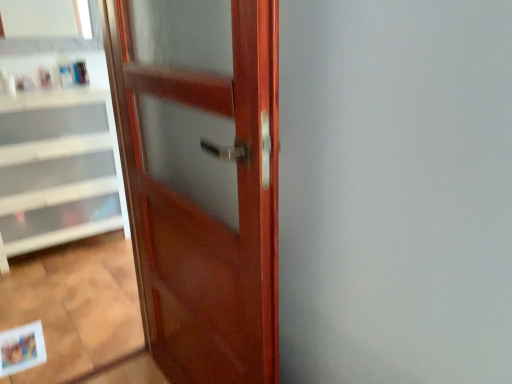
The image size is (512, 384). What do you see at coordinates (65, 71) in the screenshot? I see `translucent plastic bottle at upper left, the 2th toiletry in the right-to-left sequence` at bounding box center [65, 71].

What is the approximate width of matte plastic bottle at upper left, the first toiletry when ordered from left to right?

2.29 inches.

The width and height of the screenshot is (512, 384). What do you see at coordinates (45, 78) in the screenshot?
I see `matte plastic bottle at upper left, the first toiletry when ordered from left to right` at bounding box center [45, 78].

I want to click on white glossy cabinet at left, so click(56, 168).

The width and height of the screenshot is (512, 384). What are the coordinates of `translucent plastic bottle at upper left, which ranks as the second toiletry in left-to-right order` in the screenshot? It's located at (65, 71).

In the image, is translucent plastic bottle at upper left, the 2th toiletry in the right-to-left sequence, positioned in front of or behind matte plastic bottle at upper left, positioned as the third toiletry in left-to-right order?

In the image, translucent plastic bottle at upper left, the 2th toiletry in the right-to-left sequence, appears in front of matte plastic bottle at upper left, positioned as the third toiletry in left-to-right order.

From the image's perspective, is translucent plastic bottle at upper left, the 2th toiletry in the right-to-left sequence, located above or below matte plastic bottle at upper left, the first toiletry viewed from the right?

Clearly, from the image's perspective, translucent plastic bottle at upper left, the 2th toiletry in the right-to-left sequence, is below matte plastic bottle at upper left, the first toiletry viewed from the right.

Find the location of a particular element. the 1st toiletry counting from the left of the matte plastic bottle at upper left, positioned as the third toiletry in left-to-right order is located at coordinates (65, 71).

Is translucent plastic bottle at upper left, which ranks as the second toiletry in left-to-right order, taller than matte plastic bottle at upper left, positioned as the third toiletry in left-to-right order?

Correct, translucent plastic bottle at upper left, which ranks as the second toiletry in left-to-right order, is much taller as matte plastic bottle at upper left, positioned as the third toiletry in left-to-right order.

From the picture: Is matte paper postcard at lower left wider or thinner than matte plastic bottle at upper left, the first toiletry viewed from the right?

matte paper postcard at lower left is wider than matte plastic bottle at upper left, the first toiletry viewed from the right.

Is matte paper postcard at lower left touching matte plastic bottle at upper left, positioned as the third toiletry in left-to-right order?

There is a gap between matte paper postcard at lower left and matte plastic bottle at upper left, positioned as the third toiletry in left-to-right order.

Measure the distance between matte paper postcard at lower left and matte plastic bottle at upper left, positioned as the third toiletry in left-to-right order.

The distance of matte paper postcard at lower left from matte plastic bottle at upper left, positioned as the third toiletry in left-to-right order, is 1.65 meters.

Is matte paper postcard at lower left to the left of matte plastic bottle at upper left, positioned as the third toiletry in left-to-right order, from the viewer's perspective?

Incorrect, matte paper postcard at lower left is not on the left side of matte plastic bottle at upper left, positioned as the third toiletry in left-to-right order.

Considering the relative positions of matte plastic bottle at upper left, positioned as the third toiletry in left-to-right order, and translucent plastic bottle at upper left, the 2th toiletry in the right-to-left sequence, in the image provided, is matte plastic bottle at upper left, positioned as the third toiletry in left-to-right order, to the left of translucent plastic bottle at upper left, the 2th toiletry in the right-to-left sequence, from the viewer's perspective?

No.

Locate an element on the screen. toiletry above the translucent plastic bottle at upper left, which ranks as the second toiletry in left-to-right order (from the image's perspective) is located at coordinates (80, 72).

Is matte plastic bottle at upper left, positioned as the third toiletry in left-to-right order, turned away from translucent plastic bottle at upper left, the 2th toiletry in the right-to-left sequence?

No, translucent plastic bottle at upper left, the 2th toiletry in the right-to-left sequence, is not at the back of matte plastic bottle at upper left, positioned as the third toiletry in left-to-right order.

Is matte plastic bottle at upper left, the first toiletry viewed from the right, touching translucent plastic bottle at upper left, which ranks as the second toiletry in left-to-right order?

Yes, matte plastic bottle at upper left, the first toiletry viewed from the right, is beside translucent plastic bottle at upper left, which ranks as the second toiletry in left-to-right order.

Who is shorter, white glossy cabinet at left or matte paper postcard at lower left?

Standing shorter between the two is matte paper postcard at lower left.

I want to click on cabinetry behind the matte paper postcard at lower left, so click(x=56, y=168).

Looking at the image, does white glossy cabinet at left seem bigger or smaller compared to matte paper postcard at lower left?

Considering their sizes, white glossy cabinet at left takes up more space than matte paper postcard at lower left.

Is white glossy cabinet at left situated inside matte paper postcard at lower left or outside?

white glossy cabinet at left is not inside matte paper postcard at lower left, it's outside.

Do you think glossy wood door at center is within matte paper postcard at lower left, or outside of it?

glossy wood door at center is not enclosed by matte paper postcard at lower left.

How different are the orientations of glossy wood door at center and matte paper postcard at lower left in degrees?

85.9 degrees.

Identify the location of postcard behind the glossy wood door at center. The image size is (512, 384). (22, 348).

Looking at this image, between glossy wood door at center and matte paper postcard at lower left, which one is positioned behind?

matte paper postcard at lower left is further from the camera.

Is translucent plastic bottle at upper left, the 2th toiletry in the right-to-left sequence, aimed at white glossy cabinet at left?

No.

From a real-world perspective, is translucent plastic bottle at upper left, the 2th toiletry in the right-to-left sequence, beneath white glossy cabinet at left?

Incorrect, from a real-world perspective, translucent plastic bottle at upper left, the 2th toiletry in the right-to-left sequence, is higher than white glossy cabinet at left.

Is there a large distance between translucent plastic bottle at upper left, the 2th toiletry in the right-to-left sequence, and white glossy cabinet at left?

Actually, translucent plastic bottle at upper left, the 2th toiletry in the right-to-left sequence, and white glossy cabinet at left are a little close together.

Is point (60, 72) closer or farther from the camera than point (24, 129)?

Clearly, point (60, 72) is more distant from the camera than point (24, 129).

Does matte paper postcard at lower left have a greater height compared to white glossy cabinet at left?

Incorrect, the height of matte paper postcard at lower left is not larger of that of white glossy cabinet at left.

Is white glossy cabinet at left completely or partially inside matte paper postcard at lower left?

No, white glossy cabinet at left is not a part of matte paper postcard at lower left.

Is point (7, 364) closer to viewer compared to point (123, 223)?

Yes.

Is matte paper postcard at lower left to the left or to the right of white glossy cabinet at left in the image?

matte paper postcard at lower left is positioned on white glossy cabinet at left's right side.

At what (x,y) coordinates should I click in order to perform the action: click on toiletry that is the 1st object located below the matte plastic bottle at upper left, the first toiletry viewed from the right (from the image's perspective). Please return your answer as a coordinate pair (x, y). Image resolution: width=512 pixels, height=384 pixels. Looking at the image, I should click on (65, 71).

Image resolution: width=512 pixels, height=384 pixels. Find the location of `the 3rd toiletry behind the matte paper postcard at lower left, starting your count from the anchor`. the 3rd toiletry behind the matte paper postcard at lower left, starting your count from the anchor is located at coordinates (80, 72).

Looking at this image, from the image, which object appears to be nearer to matte plastic bottle at upper left, the first toiletry viewed from the right, white glossy cabinet at left or glossy wood door at center?

The object closer to matte plastic bottle at upper left, the first toiletry viewed from the right, is white glossy cabinet at left.

Considering their positions, is matte plastic bottle at upper left, the first toiletry viewed from the right, positioned further to white glossy cabinet at left than matte plastic bottle at upper left, positioned as the 3th toiletry in right-to-left order?

matte plastic bottle at upper left, the first toiletry viewed from the right.

When comparing their distances from matte plastic bottle at upper left, positioned as the third toiletry in left-to-right order, does matte plastic bottle at upper left, positioned as the 3th toiletry in right-to-left order, or matte paper postcard at lower left seem closer?

matte plastic bottle at upper left, positioned as the 3th toiletry in right-to-left order, is closer to matte plastic bottle at upper left, positioned as the third toiletry in left-to-right order.

Which object lies nearer to the anchor point matte paper postcard at lower left, matte plastic bottle at upper left, positioned as the 3th toiletry in right-to-left order, or white glossy cabinet at left?

white glossy cabinet at left is positioned closer to the anchor matte paper postcard at lower left.

Looking at the image, which one is located further to glossy wood door at center, translucent plastic bottle at upper left, the 2th toiletry in the right-to-left sequence, or matte paper postcard at lower left?

translucent plastic bottle at upper left, the 2th toiletry in the right-to-left sequence, is positioned further to the anchor glossy wood door at center.

When comparing their distances from translucent plastic bottle at upper left, the 2th toiletry in the right-to-left sequence, does matte plastic bottle at upper left, the first toiletry when ordered from left to right, or matte plastic bottle at upper left, positioned as the third toiletry in left-to-right order, seem further?

matte plastic bottle at upper left, the first toiletry when ordered from left to right, is positioned further to the anchor translucent plastic bottle at upper left, the 2th toiletry in the right-to-left sequence.

Based on their spatial positions, is white glossy cabinet at left or matte plastic bottle at upper left, positioned as the 3th toiletry in right-to-left order, further from matte plastic bottle at upper left, the first toiletry viewed from the right?

white glossy cabinet at left lies further to matte plastic bottle at upper left, the first toiletry viewed from the right, than the other object.

From the image, which object appears to be nearer to matte plastic bottle at upper left, positioned as the third toiletry in left-to-right order, matte plastic bottle at upper left, positioned as the 3th toiletry in right-to-left order, or translucent plastic bottle at upper left, the 2th toiletry in the right-to-left sequence?

Among the two, translucent plastic bottle at upper left, the 2th toiletry in the right-to-left sequence, is located nearer to matte plastic bottle at upper left, positioned as the third toiletry in left-to-right order.

Where is `cabinetry that lies between matte plastic bottle at upper left, positioned as the third toiletry in left-to-right order, and matte paper postcard at lower left from top to bottom`? The image size is (512, 384). cabinetry that lies between matte plastic bottle at upper left, positioned as the third toiletry in left-to-right order, and matte paper postcard at lower left from top to bottom is located at coordinates (56, 168).

I want to click on postcard positioned between glossy wood door at center and translucent plastic bottle at upper left, the 2th toiletry in the right-to-left sequence, from near to far, so click(x=22, y=348).

The width and height of the screenshot is (512, 384). I want to click on postcard between glossy wood door at center and matte plastic bottle at upper left, the first toiletry when ordered from left to right, in the front-back direction, so click(22, 348).

The width and height of the screenshot is (512, 384). I want to click on toiletry located between glossy wood door at center and translucent plastic bottle at upper left, which ranks as the second toiletry in left-to-right order, in the depth direction, so click(x=45, y=78).